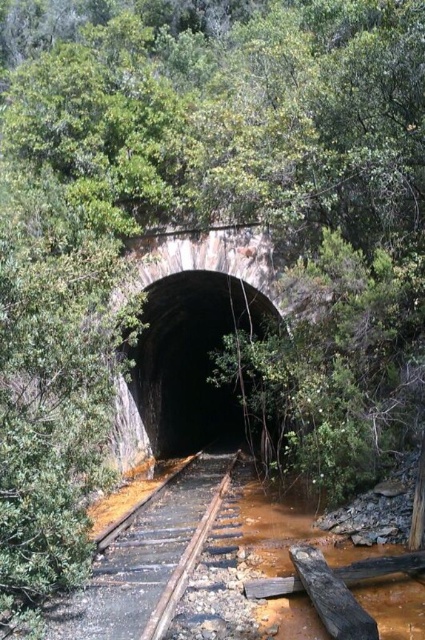
You are a train engineer approaching the black concrete tunnel at center with a brown wooden train track at center leading into it. Your train is 10 meters wide. Can you safely pass through the tunnel?

The black concrete tunnel at center is bigger than the brown wooden train track at center, but the description does not specify the exact dimensions of the tunnel or track. Without knowing the tunnel width, it is impossible to determine if the 10m wide train can safely pass.